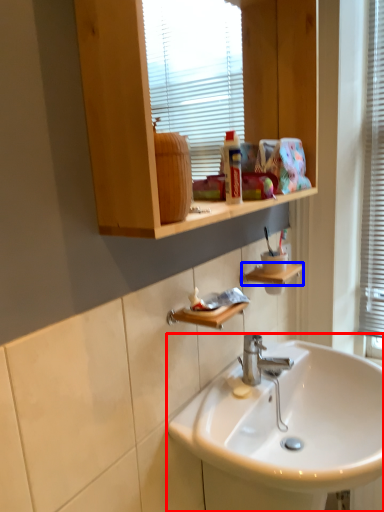
Question: Which point is closer to the camera, sink (highlighted by a red box) or shelf (highlighted by a blue box)?

Choices:
 (A) sink
 (B) shelf

Answer: (A)